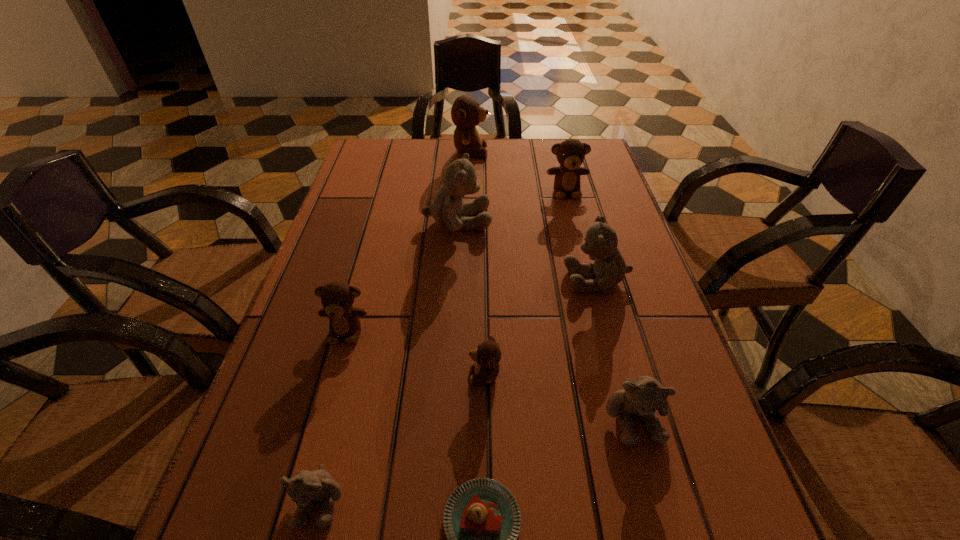
Find the location of a particular element. the farthest object is located at coordinates (466, 113).

Find the location of a particular element. This screenshot has height=540, width=960. the farthest teddy bear is located at coordinates (466, 113).

This screenshot has height=540, width=960. Find the location of `the biggest gray teddy bear`. the biggest gray teddy bear is located at coordinates (447, 209).

At what (x,y) coordinates should I click in order to perform the action: click on the seventh nearest object. Please return your answer as a coordinate pair (x, y). This screenshot has width=960, height=540. Looking at the image, I should click on (447, 209).

What are the coordinates of `the second farthest brown teddy bear` in the screenshot? It's located at (570, 154).

Locate an element on the screen. This screenshot has height=540, width=960. the rightmost brown teddy bear is located at coordinates (570, 154).

Identify the location of the sixth nearest object. The width and height of the screenshot is (960, 540). (609, 268).

Locate an element on the screen. the fourth farthest teddy bear is located at coordinates (609, 268).

At what (x,y) coordinates should I click in order to perform the action: click on the fifth nearest object. Please return your answer as a coordinate pair (x, y). The image size is (960, 540). Looking at the image, I should click on (337, 298).

Locate an element on the screen. Image resolution: width=960 pixels, height=540 pixels. the leftmost brown teddy bear is located at coordinates (337, 298).